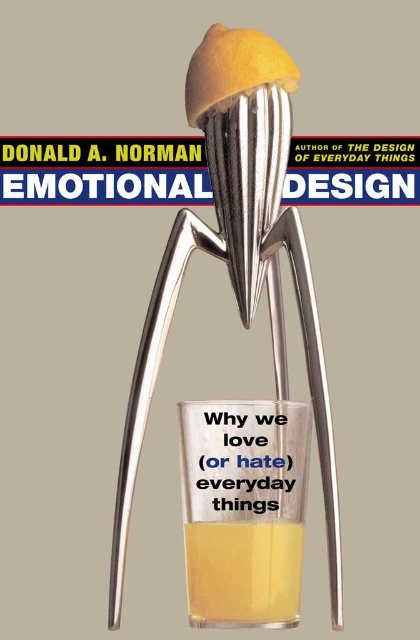
Question: Which object is closer to the camera taking this photo?

Choices:
 (A) yellow translucent liquid at center
 (B) polished metal juicer at center
 (C) yellow translucent liquid at lower center
 (D) yellow matte lemon at center

Answer: (B)

Question: Can you confirm if yellow translucent liquid at lower center is bigger than yellow matte lemon at center?

Choices:
 (A) yes
 (B) no

Answer: (B)

Question: Estimate the real-world distances between objects in this image. Which object is closer to the yellow translucent liquid at lower center?

Choices:
 (A) polished metal juicer at center
 (B) yellow matte lemon at center

Answer: (A)

Question: Among these points, which one is nearest to the camera?

Choices:
 (A) (254, 605)
 (B) (257, 602)
 (C) (215, 556)
 (D) (220, 93)

Answer: (A)

Question: Can you confirm if polished metal juicer at center is smaller than yellow translucent liquid at center?

Choices:
 (A) no
 (B) yes

Answer: (A)

Question: Does yellow translucent liquid at center appear over yellow matte lemon at center?

Choices:
 (A) yes
 (B) no

Answer: (B)